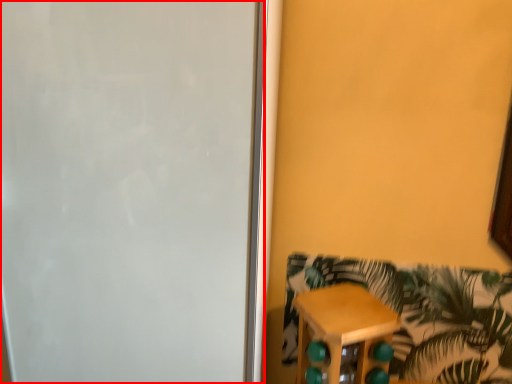
Question: Considering the relative positions of screen door (annotated by the red box) and furniture in the image provided, where is screen door (annotated by the red box) located with respect to the staircase?

Choices:
 (A) left
 (B) right

Answer: (A)